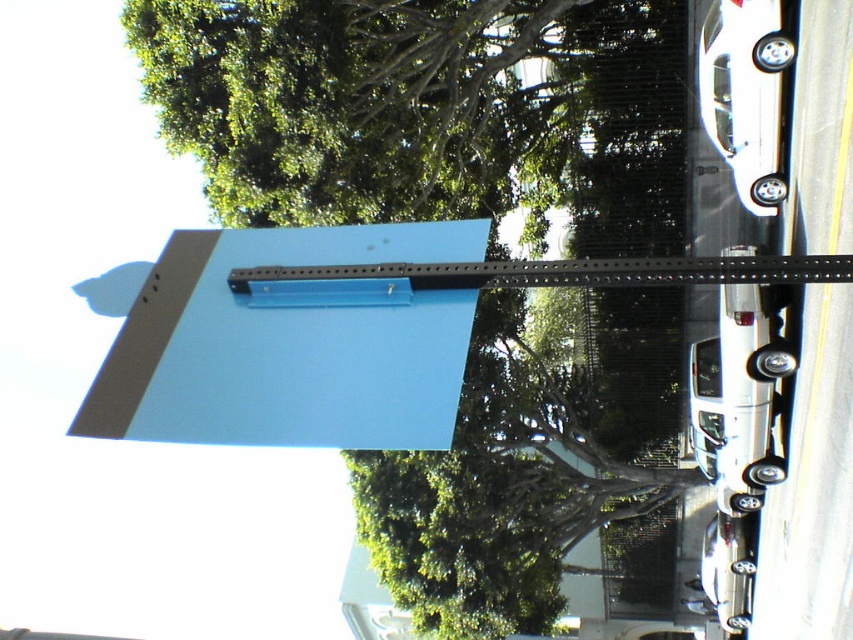
You are standing in the outdoor urban area shown in the image. You want to take a photo of the green leafy tree at upper center without any obstructions. The camera you are using has a minimum focusing distance of 4 meters. Can you take the photo from your current position?

The green leafy tree at upper center is 4.01 meters from viewer. Since the minimum focusing distance is 4 meters, the camera can focus on the tree as it is just slightly beyond the minimum distance.

You are a photographer trying to capture a clear shot of the blue matte sign at upper center without the green leafy tree at upper center blocking it. Based on their sizes, which object should you adjust your camera angle to focus on first to ensure the sign is visible?

The green leafy tree at upper center has a larger width than the blue matte sign at upper center. To ensure the sign is visible, adjust your camera angle to focus on the green leafy tree at upper center first, as its larger size may obstruct the view of the sign.

You are a pedestrian standing in front of the green leafy tree at upper center and the blue matte sign at upper center. Which object is closer to you?

The green leafy tree at upper center is closer to you because the blue matte sign at upper center is behind it.